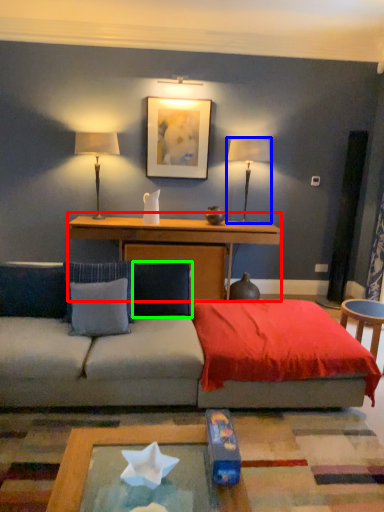
Question: Considering the real-world distances, which object is closest to table (highlighted by a red box)? table lamp (highlighted by a blue box) or pillow (highlighted by a green box).

Choices:
 (A) table lamp
 (B) pillow

Answer: (A)